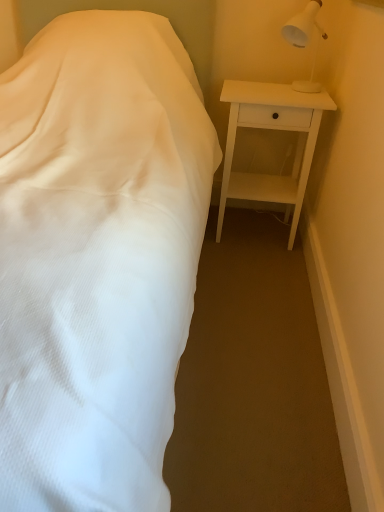
In order to face white plastic lamp at upper right, should I rotate leftwards or rightwards?

Rotate your view right by about 15.092°.

You are a GUI agent. You are given a task and a screenshot of the screen. Output one action in this format:
    pyautogui.click(x=<x>, y=<y>)
    Task: Click on the white plastic lamp at upper right
    
    Given the screenshot: What is the action you would take?
    pyautogui.click(x=305, y=40)

Describe the element at coordinates (305, 40) in the screenshot. I see `white plastic lamp at upper right` at that location.

The height and width of the screenshot is (512, 384). What do you see at coordinates (273, 129) in the screenshot?
I see `white matte nightstand at right` at bounding box center [273, 129].

Locate an element on the screen. white matte nightstand at right is located at coordinates (273, 129).

The height and width of the screenshot is (512, 384). What are the coordinates of `white plastic lamp at upper right` in the screenshot? It's located at (305, 40).

Does white matte nightstand at right appear on the right side of white plastic lamp at upper right?

Incorrect, white matte nightstand at right is not on the right side of white plastic lamp at upper right.

In the image, is white matte nightstand at right positioned in front of or behind white plastic lamp at upper right?

In the image, white matte nightstand at right appears behind white plastic lamp at upper right.

Which is behind, point (265, 103) or point (315, 56)?

Point (315, 56)

Looking at this image, from the image's perspective, is white matte nightstand at right above or below white plastic lamp at upper right?

white matte nightstand at right is situated lower than white plastic lamp at upper right in the image.

Looking at this image, from a real-world perspective, which is physically below, white matte nightstand at right or white plastic lamp at upper right?

From a 3D spatial view, white matte nightstand at right is below.

Does white matte nightstand at right have a greater width compared to white plastic lamp at upper right?

Correct, the width of white matte nightstand at right exceeds that of white plastic lamp at upper right.

Considering the relative sizes of white matte nightstand at right and white plastic lamp at upper right in the image provided, is white matte nightstand at right taller than white plastic lamp at upper right?

Correct, white matte nightstand at right is much taller as white plastic lamp at upper right.

Does white matte nightstand at right have a smaller size compared to white plastic lamp at upper right?

No.

Is white matte nightstand at right not inside white plastic lamp at upper right?

Yes, white matte nightstand at right is outside of white plastic lamp at upper right.

Is white matte nightstand at right with white plastic lamp at upper right?

No, white matte nightstand at right is not touching white plastic lamp at upper right.

Is white matte nightstand at right turned away from white plastic lamp at upper right?

No, white plastic lamp at upper right is not at the back of white matte nightstand at right.

How many degrees apart are the facing directions of white matte nightstand at right and white plastic lamp at upper right?

The angular difference between white matte nightstand at right and white plastic lamp at upper right is 0.424 degrees.

How much distance is there between white matte nightstand at right and white plastic lamp at upper right?

A distance of 32.99 centimeters exists between white matte nightstand at right and white plastic lamp at upper right.

At what (x,y) coordinates should I click in order to perform the action: click on lamp above the white matte nightstand at right (from the image's perspective). Please return your answer as a coordinate pair (x, y). Looking at the image, I should click on (305, 40).

Between white plastic lamp at upper right and white matte nightstand at right, which one appears on the right side from the viewer's perspective?

white plastic lamp at upper right.

Is the position of white plastic lamp at upper right less distant than that of white matte nightstand at right?

That is True.

Is point (314, 24) closer to camera compared to point (312, 97)?

No, (314, 24) is further to viewer.

From the image's perspective, which one is positioned lower, white plastic lamp at upper right or white matte nightstand at right?

white matte nightstand at right is shown below in the image.

From a real-world perspective, which object stands above the other?

white plastic lamp at upper right is physically above.

Which object is thinner, white plastic lamp at upper right or white matte nightstand at right?

With smaller width is white plastic lamp at upper right.

Which of these two, white plastic lamp at upper right or white matte nightstand at right, stands shorter?

With less height is white plastic lamp at upper right.

Between white plastic lamp at upper right and white matte nightstand at right, which one has larger size?

white matte nightstand at right.

Is white plastic lamp at upper right outside of white matte nightstand at right?

white plastic lamp at upper right is positioned outside white matte nightstand at right.

Is white plastic lamp at upper right not near white matte nightstand at right?

No, white plastic lamp at upper right is in close proximity to white matte nightstand at right.

Could you tell me if white plastic lamp at upper right is turned towards white matte nightstand at right?

No, white plastic lamp at upper right is not facing towards white matte nightstand at right.

Can you tell me how much white plastic lamp at upper right and white matte nightstand at right differ in facing direction?

The angular difference between white plastic lamp at upper right and white matte nightstand at right is 0.424 degrees.

Where is `nightstand that appears below the white plastic lamp at upper right (from the image's perspective)`? The image size is (384, 512). nightstand that appears below the white plastic lamp at upper right (from the image's perspective) is located at coordinates (273, 129).

Image resolution: width=384 pixels, height=512 pixels. I want to click on nightstand that is behind the white plastic lamp at upper right, so click(273, 129).

Locate an element on the screen. The height and width of the screenshot is (512, 384). lamp in front of the white matte nightstand at right is located at coordinates (305, 40).